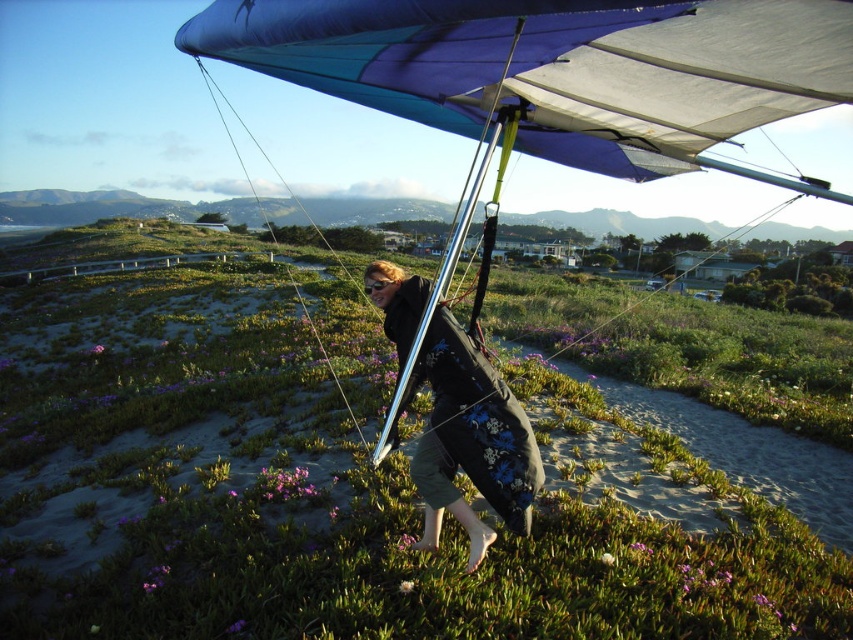
Which is more to the right, green grassy at center or blue fabric parachute at center?

blue fabric parachute at center is more to the right.

Which is behind, point (32, 408) or point (630, 51)?

Point (32, 408)

Is point (569, 563) farther from viewer compared to point (610, 140)?

That is False.

Where is `green grassy at center`? green grassy at center is located at coordinates (335, 480).

The width and height of the screenshot is (853, 640). Describe the element at coordinates (556, 67) in the screenshot. I see `blue fabric canopy at upper center` at that location.

You are a GUI agent. You are given a task and a screenshot of the screen. Output one action in this format:
    pyautogui.click(x=<x>, y=<y>)
    Task: Click on the blue fabric canopy at upper center
    
    Given the screenshot: What is the action you would take?
    pyautogui.click(x=556, y=67)

Is green grassy at center closer to camera compared to purple matte flower at center?

Yes, green grassy at center is in front of purple matte flower at center.

Where is `green grassy at center`? green grassy at center is located at coordinates (335, 480).